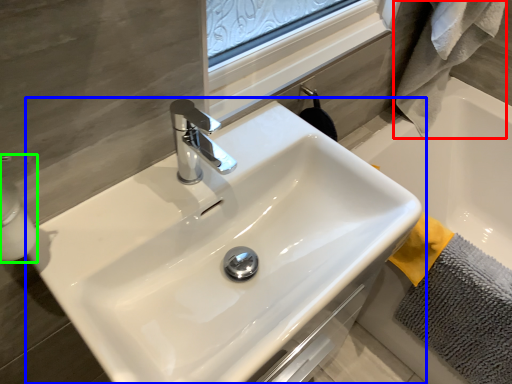
Question: Which is nearer to the bath towel (highlighted by a red box)? sink (highlighted by a blue box) or soap dispenser (highlighted by a green box).

Choices:
 (A) sink
 (B) soap dispenser

Answer: (A)